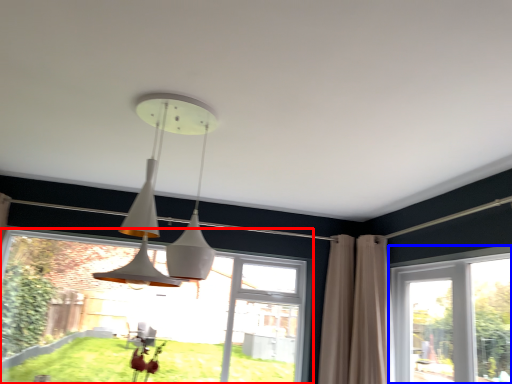
Question: Which object appears closest to the camera in this image, window (highlighted by a red box) or window (highlighted by a blue box)?

Choices:
 (A) window
 (B) window

Answer: (B)